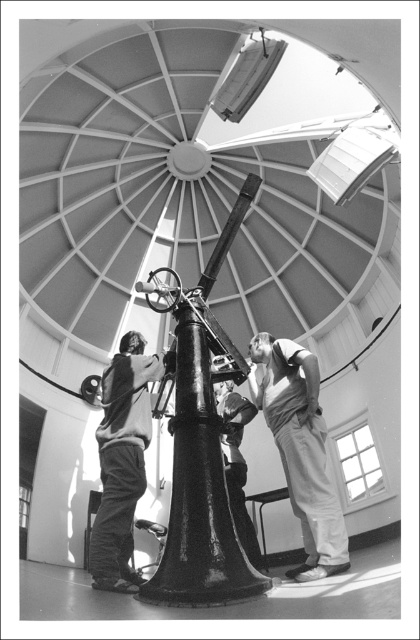
Between point (186, 291) and point (235, 513), which one is positioned behind?

Positioned behind is point (235, 513).

The height and width of the screenshot is (640, 420). I want to click on polished metal telescope at center, so click(202, 452).

Based on the photo, is matte black clothing at center thinner than smooth fabric shirt at center?

No.

Find the location of a particular element. Image resolution: width=420 pixels, height=640 pixels. matte black clothing at center is located at coordinates (123, 460).

Locate an element on the screen. The width and height of the screenshot is (420, 640). matte black clothing at center is located at coordinates [123, 460].

Does point (189, 529) come behind point (118, 422)?

No, it is not.

Can you confirm if polished metal telescope at center is smaller than matte black clothing at center?

Correct, polished metal telescope at center occupies less space than matte black clothing at center.

Is point (197, 442) less distant than point (115, 400)?

Yes, point (197, 442) is in front of point (115, 400).

The width and height of the screenshot is (420, 640). I want to click on polished metal telescope at center, so click(202, 452).